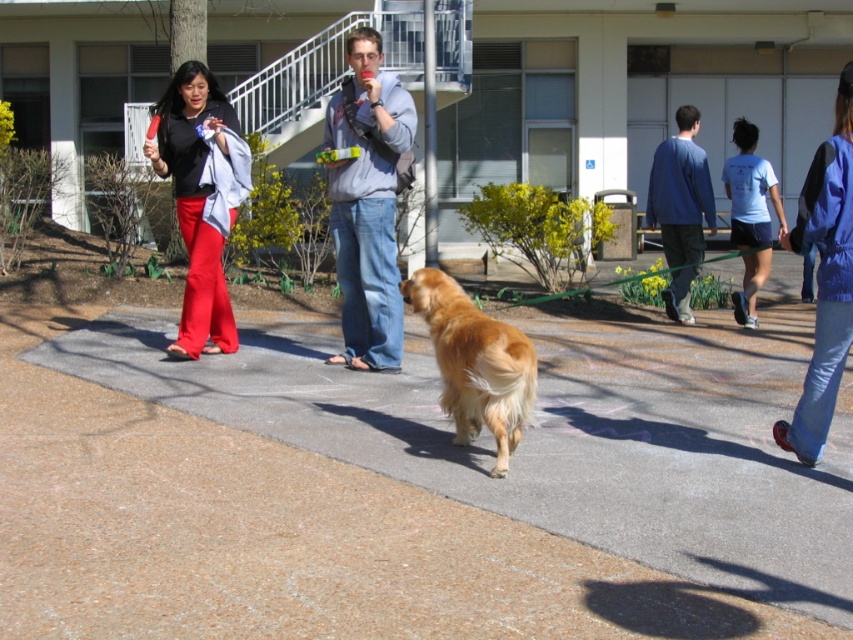
You are standing at the point marked by the coordinates (399, 488). Based on the scene description, what type of surface are you standing on?

The point marked by the coordinates (399, 488) is on brown concrete pavement at center.

You are standing at the point marked as point (399, 488). What kind of surface are you standing on?

You are standing on brown concrete pavement at center.